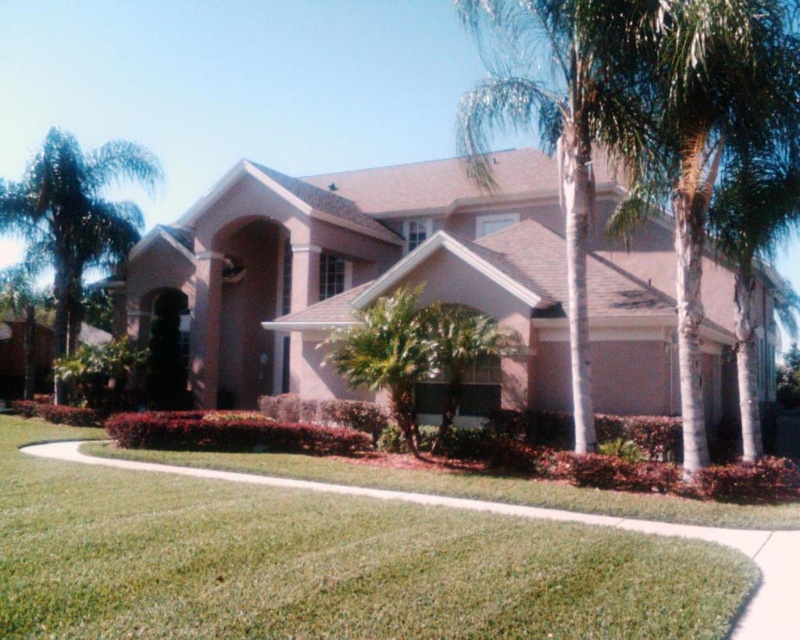
Question: Among these points, which one is farthest from the camera?

Choices:
 (A) (128, 141)
 (B) (772, 150)

Answer: (A)

Question: Can you confirm if green grass at center is wider than green leafy palm tree at left?

Choices:
 (A) yes
 (B) no

Answer: (A)

Question: Considering the real-world distances, which object is farthest from the green leafy palm tree at left?

Choices:
 (A) green grass at center
 (B) green leafy palm tree at right
 (C) green leafy palm tree at center

Answer: (B)

Question: Can you confirm if green grass at center is positioned below green leafy palm tree at center?

Choices:
 (A) yes
 (B) no

Answer: (A)

Question: Among these points, which one is nearest to the camera?

Choices:
 (A) (737, 152)
 (B) (114, 218)
 (C) (522, 566)

Answer: (C)

Question: Can you confirm if green leafy palm tree at right is thinner than green leafy palm tree at left?

Choices:
 (A) no
 (B) yes

Answer: (B)